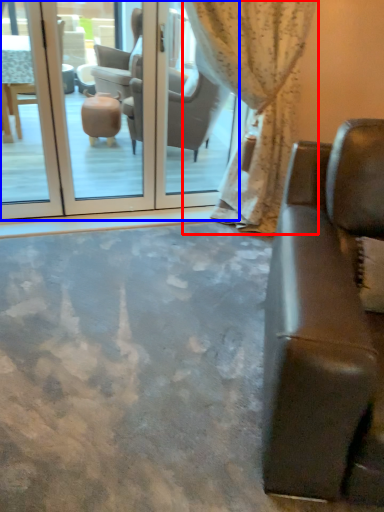
Question: Which of the following is the farthest to the observer, curtain (highlighted by a red box) or screen door (highlighted by a blue box)?

Choices:
 (A) curtain
 (B) screen door

Answer: (B)